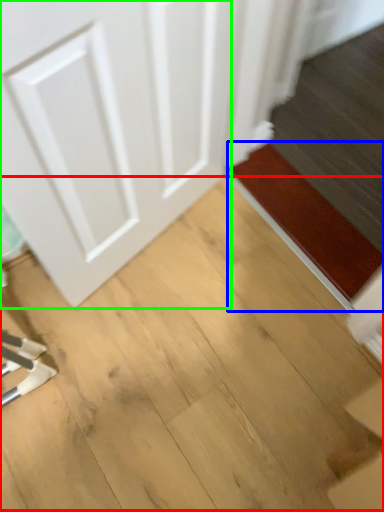
Question: Which object is the farthest from plywood (highlighted by a red box)? Choose among these: doormat (highlighted by a blue box) or door (highlighted by a green box).

Choices:
 (A) doormat
 (B) door

Answer: (B)